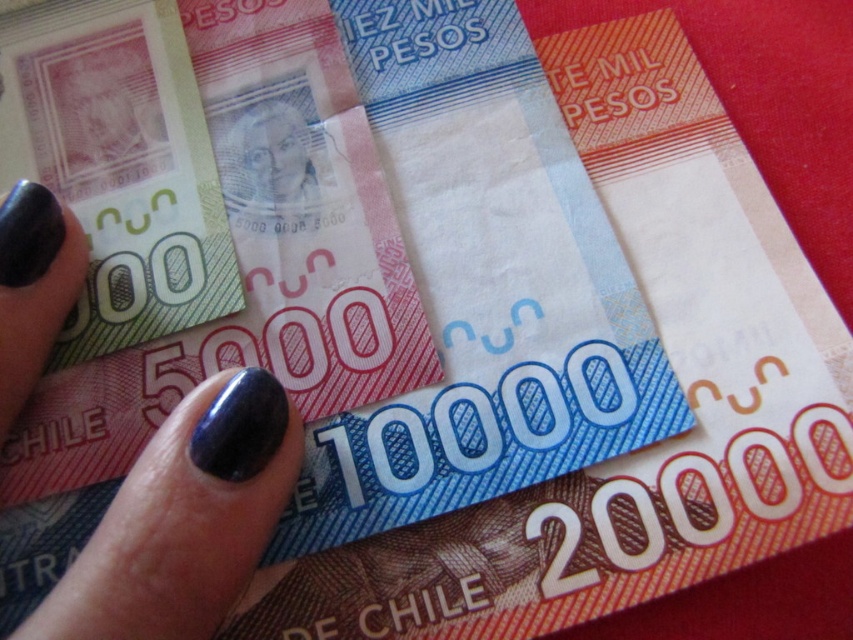
Question: From the image, what is the correct spatial relationship of nail polish at center in relation to nail polish at lower left?

Choices:
 (A) left
 (B) right

Answer: (B)

Question: Does nail polish at center have a greater width compared to nail polish at lower left?

Choices:
 (A) no
 (B) yes

Answer: (B)

Question: Which point is closer to the camera?

Choices:
 (A) nail polish at center
 (B) smooth paper money at center
 (C) nail polish at lower left

Answer: (A)

Question: Which object appears closest to the camera in this image?

Choices:
 (A) smooth paper money at center
 (B) nail polish at center
 (C) nail polish at lower left

Answer: (B)

Question: Among these points, which one is farthest from the camera?

Choices:
 (A) (238, 212)
 (B) (4, 298)
 (C) (187, 540)

Answer: (A)

Question: Can you confirm if nail polish at center is smaller than nail polish at lower left?

Choices:
 (A) no
 (B) yes

Answer: (A)